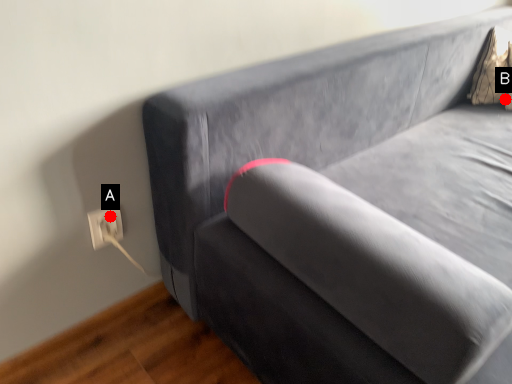
Question: Two points are circled on the image, labeled by A and B beside each circle. Which point appears closest to the camera in this image?

Choices:
 (A) A is closer
 (B) B is closer

Answer: (A)